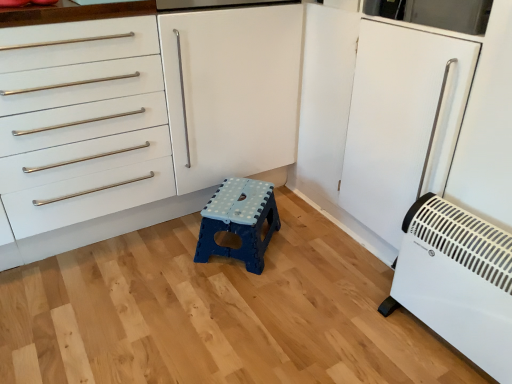
Question: From the image's perspective, would you say white plastic heater at lower right is shown under white matte cabinet at center?

Choices:
 (A) yes
 (B) no

Answer: (A)

Question: Is the depth of white plastic heater at lower right less than that of white matte cabinet at center?

Choices:
 (A) yes
 (B) no

Answer: (A)

Question: Considering the relative sizes of white plastic heater at lower right and white matte cabinet at center in the image provided, is white plastic heater at lower right shorter than white matte cabinet at center?

Choices:
 (A) no
 (B) yes

Answer: (B)

Question: Is white plastic heater at lower right with white matte cabinet at center?

Choices:
 (A) yes
 (B) no

Answer: (B)

Question: Is white plastic heater at lower right thinner than white matte cabinet at center?

Choices:
 (A) no
 (B) yes

Answer: (B)

Question: Is white plastic heater at lower right further to the viewer compared to white matte cabinet at center?

Choices:
 (A) yes
 (B) no

Answer: (B)

Question: Does white plastic heater at lower right turn towards blue plastic stool at center?

Choices:
 (A) yes
 (B) no

Answer: (B)

Question: From a real-world perspective, does white plastic heater at lower right stand above blue plastic stool at center?

Choices:
 (A) no
 (B) yes

Answer: (B)

Question: Considering the relative positions of white plastic heater at lower right and blue plastic stool at center in the image provided, is white plastic heater at lower right behind blue plastic stool at center?

Choices:
 (A) no
 (B) yes

Answer: (A)

Question: Does white plastic heater at lower right come in front of blue plastic stool at center?

Choices:
 (A) yes
 (B) no

Answer: (A)

Question: Considering the relative sizes of white plastic heater at lower right and blue plastic stool at center in the image provided, is white plastic heater at lower right taller than blue plastic stool at center?

Choices:
 (A) yes
 (B) no

Answer: (A)

Question: Is white plastic heater at lower right at the right side of blue plastic stool at center?

Choices:
 (A) no
 (B) yes

Answer: (B)

Question: Is blue plastic stool at center wider than white matte cabinet at center?

Choices:
 (A) yes
 (B) no

Answer: (B)